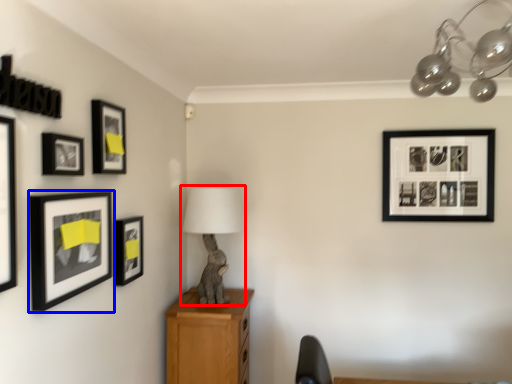
Question: Which object is closer to the camera taking this photo, table lamp (highlighted by a red box) or picture frame (highlighted by a blue box)?

Choices:
 (A) table lamp
 (B) picture frame

Answer: (B)